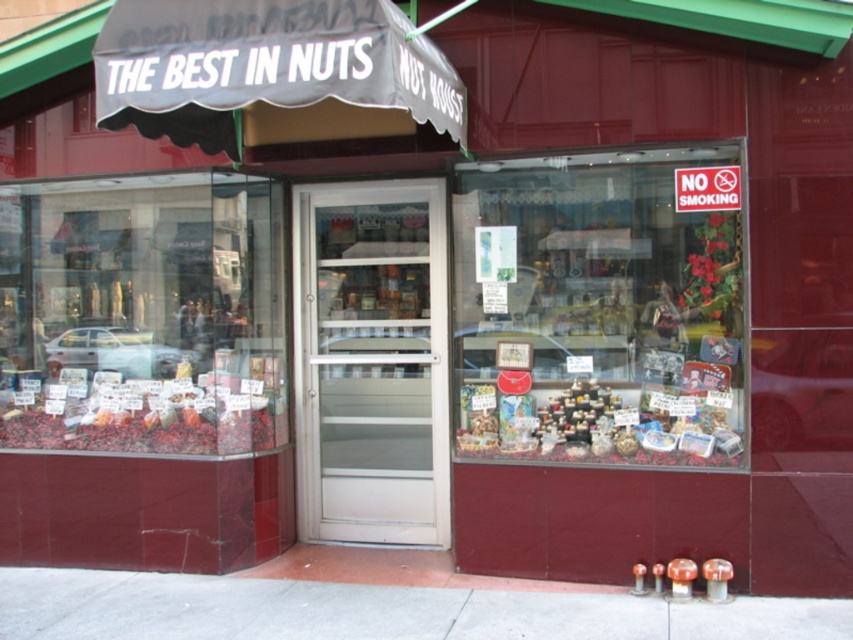
Question: Which object is positioned farthest from the white frosted glass door at center?

Choices:
 (A) translucent glass display case at center
 (B) shiny metallic nuts at lower left
 (C) shiny plastic containers at center

Answer: (B)

Question: Where is gray concrete sidewalk at lower center located in relation to shiny plastic containers at center in the image?

Choices:
 (A) right
 (B) left

Answer: (B)

Question: Among these objects, which one is farthest from the camera?

Choices:
 (A) white frosted glass door at center
 (B) gray concrete sidewalk at lower center

Answer: (A)

Question: Does translucent glass display case at center appear over white frosted glass door at center?

Choices:
 (A) no
 (B) yes

Answer: (B)

Question: In this image, where is white frosted glass door at center located relative to shiny metallic nuts at lower left?

Choices:
 (A) above
 (B) below

Answer: (A)

Question: Which object is positioned farthest from the white frosted glass door at center?

Choices:
 (A) translucent glass display case at center
 (B) shiny metallic nuts at lower left

Answer: (B)